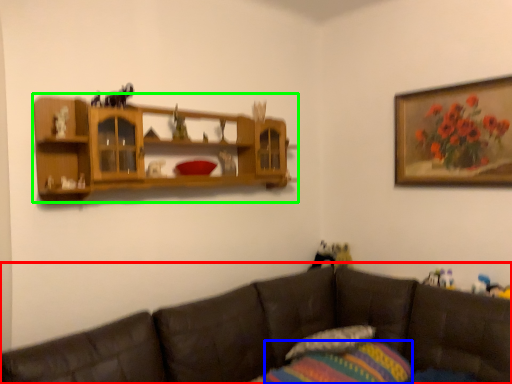
Question: Considering the real-world distances, which object is farthest from studio couch (highlighted by a red box)? pillow (highlighted by a blue box) or shelf (highlighted by a green box)?

Choices:
 (A) pillow
 (B) shelf

Answer: (B)